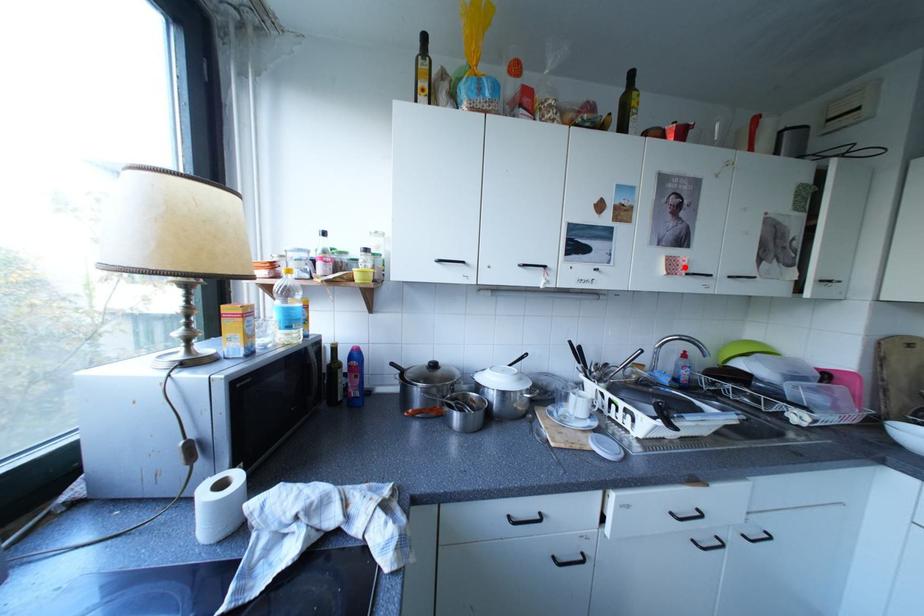
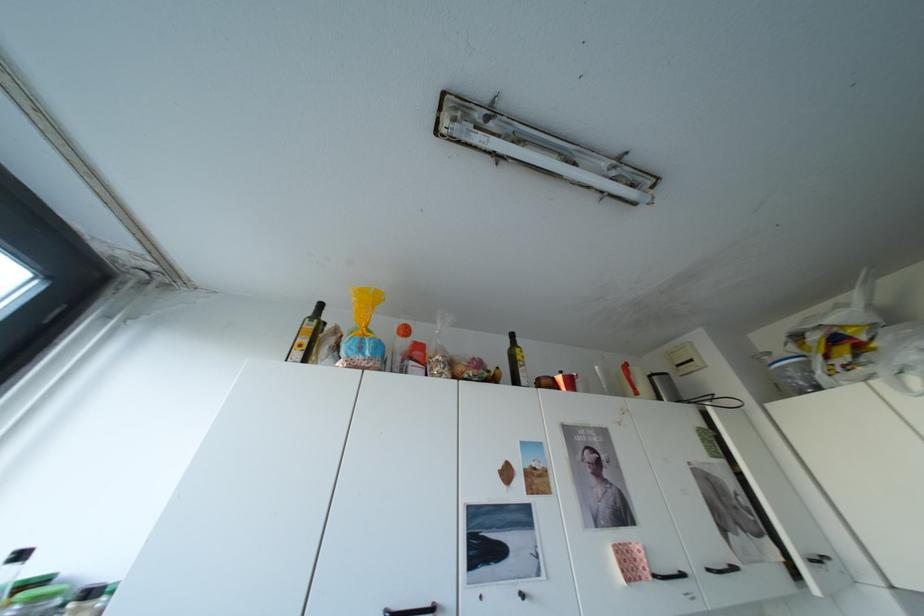
The point at the highlighted location is marked in the first image. Where is the corresponding point in the second image?

(642, 568)